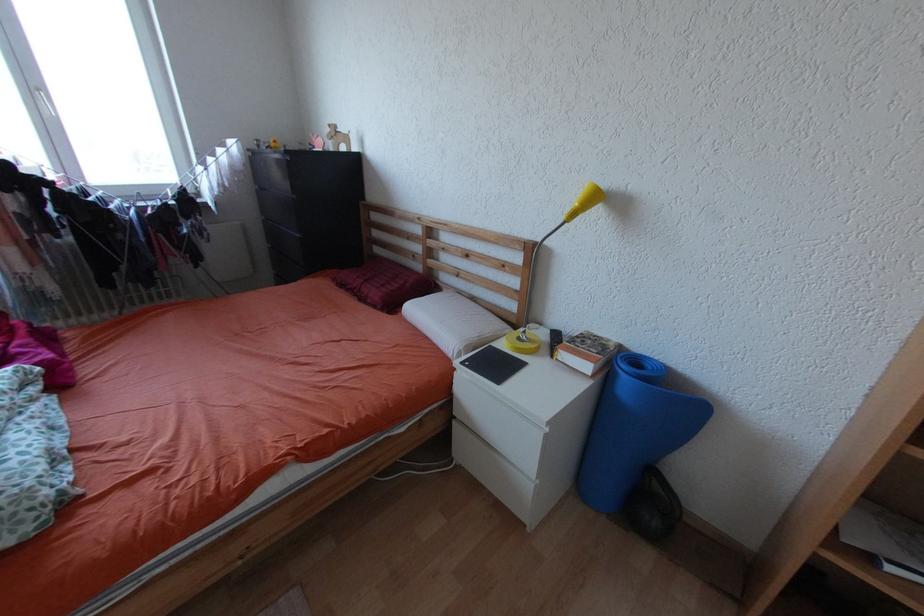
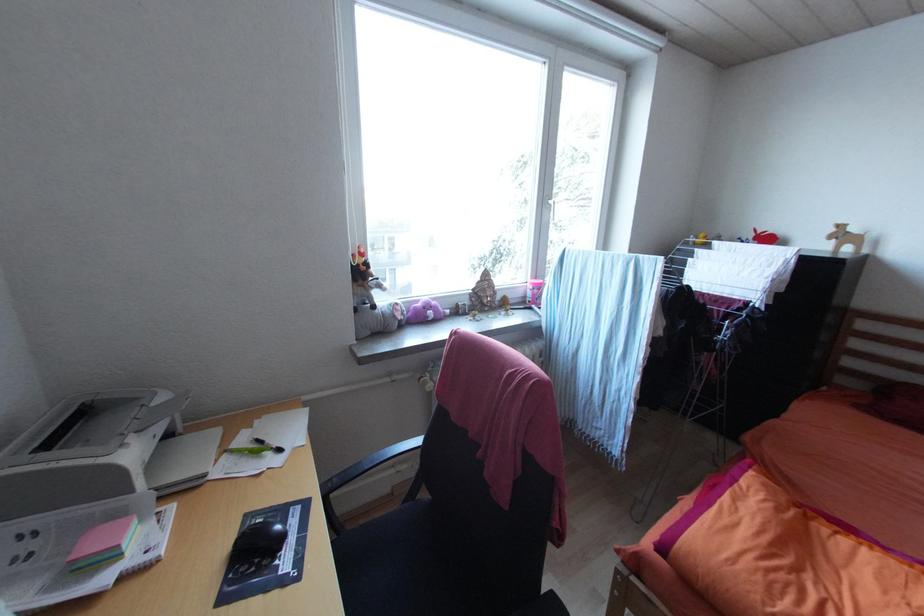
Question: In a continuous first-person perspective shot, in which direction is the camera moving?

Choices:
 (A) Left
 (B) Right
 (C) Forward
 (D) Backward

Answer: (A)